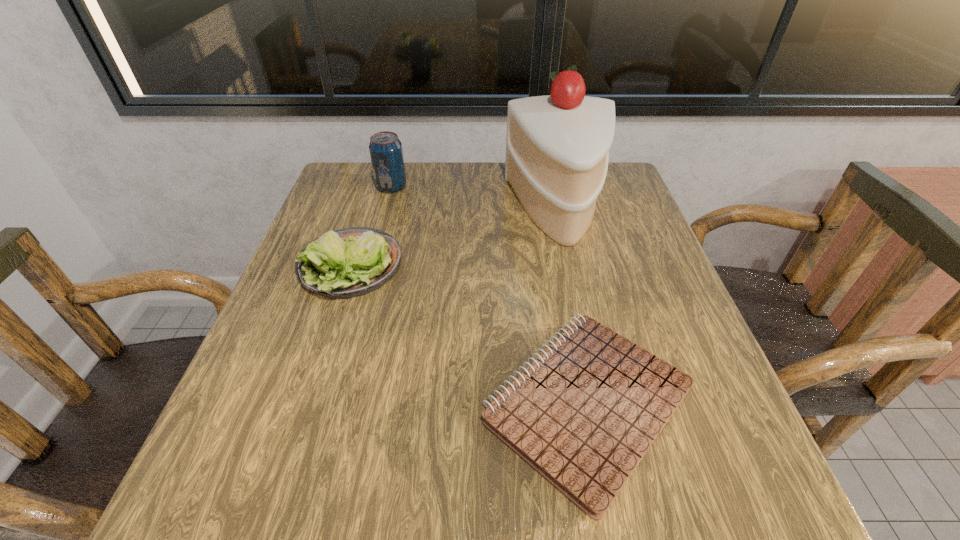
The image size is (960, 540). In order to click on cake in this screenshot , I will do `click(557, 147)`.

Where is `the second tallest object`? the second tallest object is located at coordinates (385, 148).

I want to click on the third tallest object, so click(350, 262).

Identify the location of the shortest object. (583, 414).

Identify the location of the nearest object. (583, 414).

Where is `free space located on the front of the cake`? The image size is (960, 540). free space located on the front of the cake is located at coordinates (592, 352).

The height and width of the screenshot is (540, 960). I want to click on vacant space located on the right of the second tallest object, so click(x=446, y=187).

You are a GUI agent. You are given a task and a screenshot of the screen. Output one action in this format:
    pyautogui.click(x=<x>, y=<y>)
    Task: Click on the blank space located 0.190m on the right of the lettuce
    
    Given the screenshot: What is the action you would take?
    pyautogui.click(x=495, y=267)

I want to click on vacant region located 0.190m on the back of the notebook, so click(558, 253).

Locate an element on the screen. This screenshot has height=540, width=960. cake at the far edge is located at coordinates (557, 147).